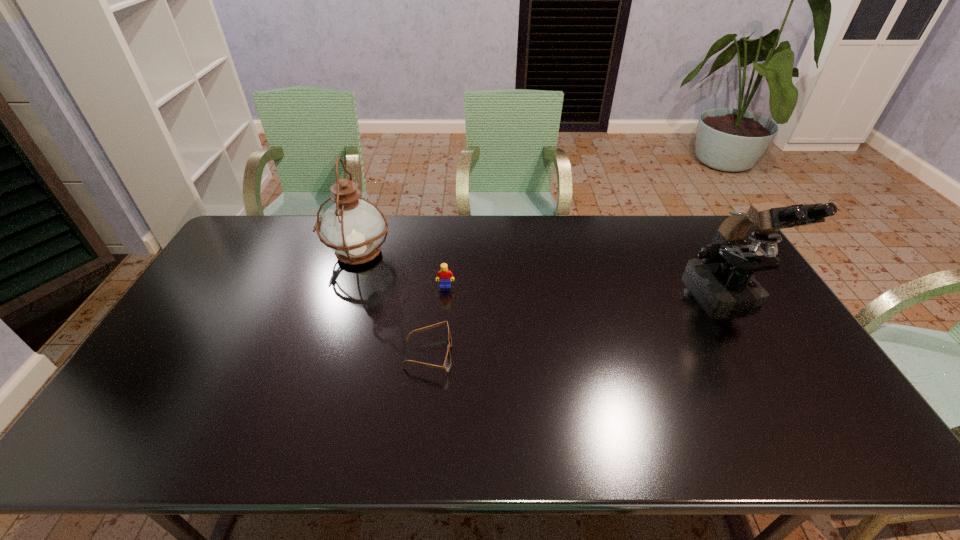
At what (x,y) coordinates should I click in order to perform the action: click on free space between the third tallest object and the oil lamp. Please return your answer as a coordinate pair (x, y). Looking at the image, I should click on (401, 270).

Image resolution: width=960 pixels, height=540 pixels. What are the coordinates of `empty location between the leftmost object and the Lego` in the screenshot? It's located at tap(401, 270).

Where is `vacant region between the rightmost object and the shortest object`? Image resolution: width=960 pixels, height=540 pixels. vacant region between the rightmost object and the shortest object is located at coordinates (577, 323).

At what (x,y) coordinates should I click in order to perform the action: click on vacant area that lies between the oil lamp and the rightmost object. Please return your answer as a coordinate pair (x, y). The width and height of the screenshot is (960, 540). Looking at the image, I should click on (542, 273).

Where is `vacant point located between the third tallest object and the oil lamp`? vacant point located between the third tallest object and the oil lamp is located at coordinates (401, 270).

In order to click on free space between the sunglasses and the second shortest object in this screenshot , I will do `click(437, 320)`.

You are a GUI agent. You are given a task and a screenshot of the screen. Output one action in this format:
    pyautogui.click(x=<x>, y=<y>)
    Task: Click on the free point between the microscope and the second shortest object
    The height and width of the screenshot is (540, 960).
    Given the screenshot: What is the action you would take?
    pyautogui.click(x=586, y=289)

Locate an element on the screen. The width and height of the screenshot is (960, 540). object that stands as the closest to the sunglasses is located at coordinates (444, 274).

Where is `object that is the closest to the rightmost object`? object that is the closest to the rightmost object is located at coordinates (447, 363).

What are the coordinates of `vacant area that satisfies the following two spatial constraints: 1. on the front side of the microscope; 2. on the right side of the oil lamp` in the screenshot? It's located at (346, 292).